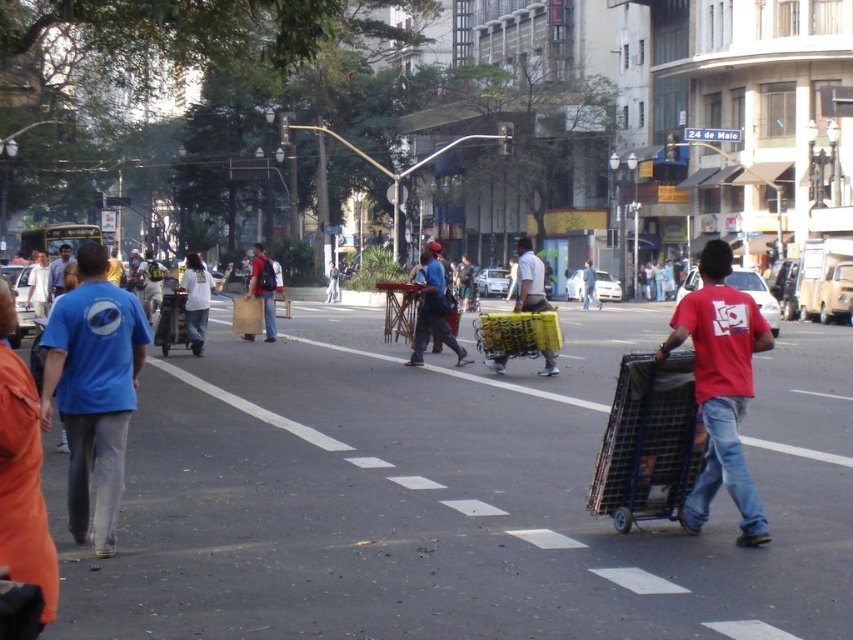
Does red matte shirt at right have a lesser height compared to metallic blue trolley at right?

No.

Between red matte shirt at right and metallic blue trolley at right, which one appears on the left side from the viewer's perspective?

Positioned to the left is metallic blue trolley at right.

Does point (764, 522) come in front of point (659, 372)?

Yes, it is in front of point (659, 372).

You are a GUI agent. You are given a task and a screenshot of the screen. Output one action in this format:
    pyautogui.click(x=<x>, y=<y>)
    Task: Click on the red matte shirt at right
    
    Given the screenshot: What is the action you would take?
    pyautogui.click(x=721, y=387)

Between blue cotton shirt at left and yellow plastic trolley at center, which one has more height?

Standing taller between the two is blue cotton shirt at left.

The height and width of the screenshot is (640, 853). What do you see at coordinates (93, 388) in the screenshot? I see `blue cotton shirt at left` at bounding box center [93, 388].

Is point (102, 538) behind point (534, 348)?

No.

This screenshot has height=640, width=853. Identify the location of blue cotton shirt at left. (93, 388).

How far apart are matte brown paper bag at center and matte blue shirt at left?

The distance of matte brown paper bag at center from matte blue shirt at left is 6.53 meters.

Does matte brown paper bag at center have a greater width compared to matte blue shirt at left?

No, matte brown paper bag at center is not wider than matte blue shirt at left.

In order to click on matte brown paper bag at center in this screenshot , I will do `click(263, 288)`.